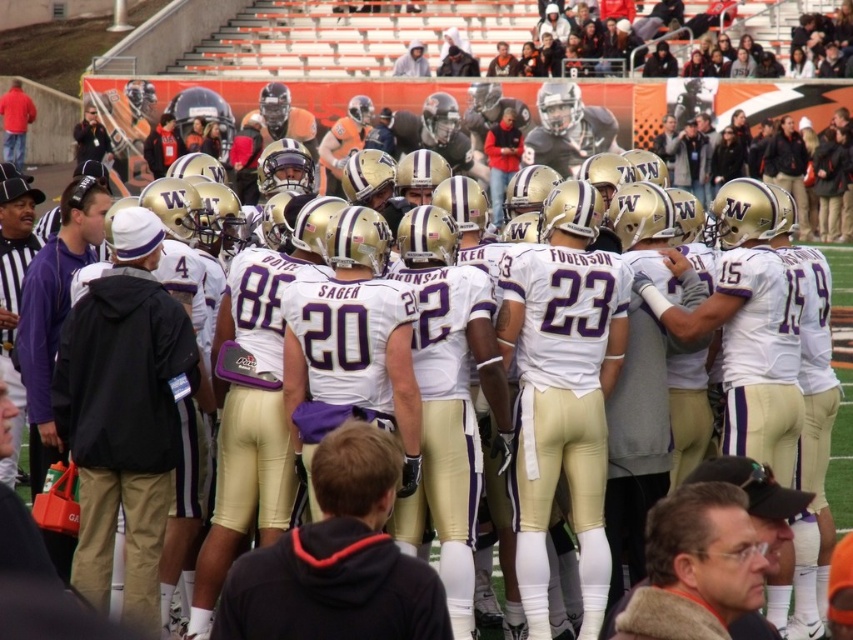
You are a photographer standing at the point marked by coordinates point (125, 412). You want to take a photo of the football team huddle. Is the black fabric jacket at center in your direct line of sight to the huddle?

The point (125, 412) marks the black fabric jacket at center, so the jacket is directly in front of you and would block your view of the huddle.

Consider the image. You are a photographer standing at the sidelines of the football game. You want to take a photo of the black fabric jacket at center and the black hoodie at center. The minimum distance your camera can focus clearly is 6 meters. Will both subjects be in focus?

The black fabric jacket at center is 6.70 meters away from the black hoodie at center. Since the minimum focusing distance is 6 meters, both subjects are beyond this distance and will be in focus.